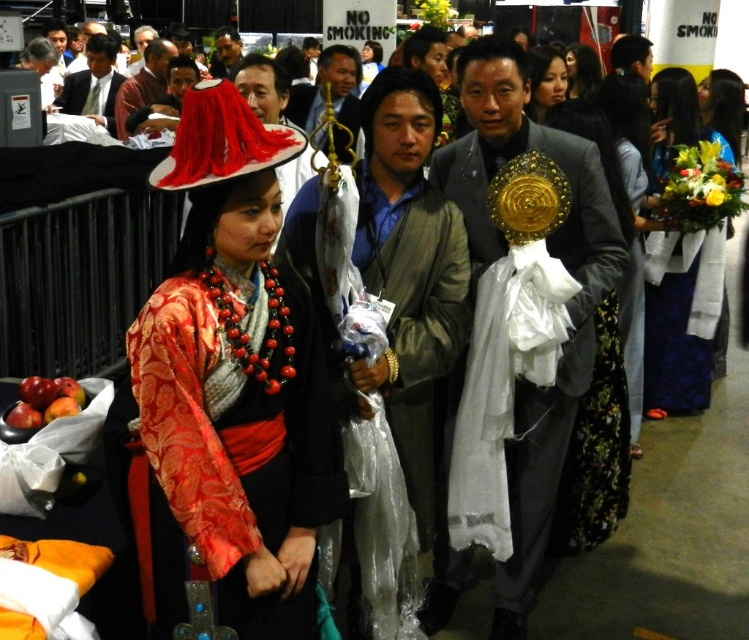
Question: Estimate the real-world distances between objects in this image. Which object is closer to the matte black suit at center?

Choices:
 (A) silky brocade dress at center
 (B) black satin dress at right
 (C) matte black dress at center

Answer: (C)

Question: Does matte black suit at center lie in front of silky black dress at center?

Choices:
 (A) yes
 (B) no

Answer: (B)

Question: Considering the real-world distances, which object is farthest from the silky black dress at center?

Choices:
 (A) matte black suit at upper left
 (B) shiny gold medallion at center
 (C) black satin dress at right

Answer: (A)

Question: Can you confirm if silky brocade dress at center is wider than matte black hat at upper center?

Choices:
 (A) yes
 (B) no

Answer: (B)

Question: Among these points, which one is nearest to the camera?

Choices:
 (A) (697, 307)
 (B) (515, 598)

Answer: (B)

Question: Does floral bouquet at right appear under matte black hat at upper center?

Choices:
 (A) yes
 (B) no

Answer: (A)